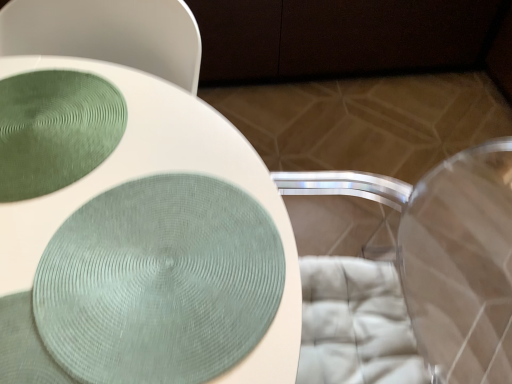
Question: Can we say green textured glass plate at upper left lies outside transparent plastic swivel chair at lower right?

Choices:
 (A) yes
 (B) no

Answer: (A)

Question: Is green textured glass plate at upper left bigger than transparent plastic swivel chair at lower right?

Choices:
 (A) yes
 (B) no

Answer: (B)

Question: From the image's perspective, is green textured glass plate at upper left located beneath transparent plastic swivel chair at lower right?

Choices:
 (A) yes
 (B) no

Answer: (B)

Question: Is the depth of green textured glass plate at upper left less than that of transparent plastic swivel chair at lower right?

Choices:
 (A) no
 (B) yes

Answer: (A)

Question: Does green textured glass plate at upper left appear on the left side of transparent plastic swivel chair at lower right?

Choices:
 (A) yes
 (B) no

Answer: (A)

Question: From the image's perspective, is green textured glass plate at upper left on transparent plastic swivel chair at lower right?

Choices:
 (A) yes
 (B) no

Answer: (A)

Question: From a real-world perspective, is matte green fabric at center physically above green textured glass plate at upper left?

Choices:
 (A) yes
 (B) no

Answer: (B)

Question: From the image's perspective, is matte green fabric at center located above green textured glass plate at upper left?

Choices:
 (A) yes
 (B) no

Answer: (B)

Question: Can you confirm if matte green fabric at center is positioned to the right of green textured glass plate at upper left?

Choices:
 (A) no
 (B) yes

Answer: (B)

Question: Can you confirm if matte green fabric at center is smaller than green textured glass plate at upper left?

Choices:
 (A) yes
 (B) no

Answer: (B)

Question: Could you tell me if matte green fabric at center is facing green textured glass plate at upper left?

Choices:
 (A) no
 (B) yes

Answer: (A)

Question: Does matte green fabric at center have a lesser height compared to green textured glass plate at upper left?

Choices:
 (A) yes
 (B) no

Answer: (B)

Question: Is matte green fabric at center outside transparent plastic swivel chair at lower right?

Choices:
 (A) no
 (B) yes

Answer: (B)